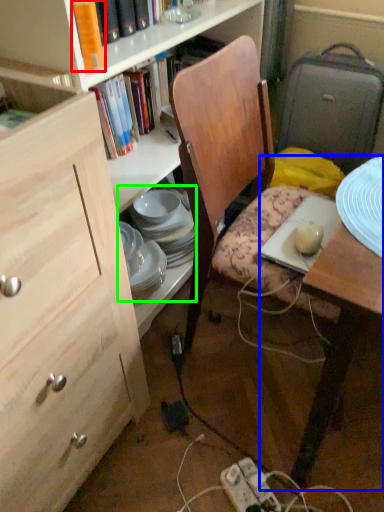
Question: Based on their relative distances, which object is farther from book (highlighted by a red box)? Choose from desk (highlighted by a blue box) and tableware (highlighted by a green box).

Choices:
 (A) desk
 (B) tableware

Answer: (B)